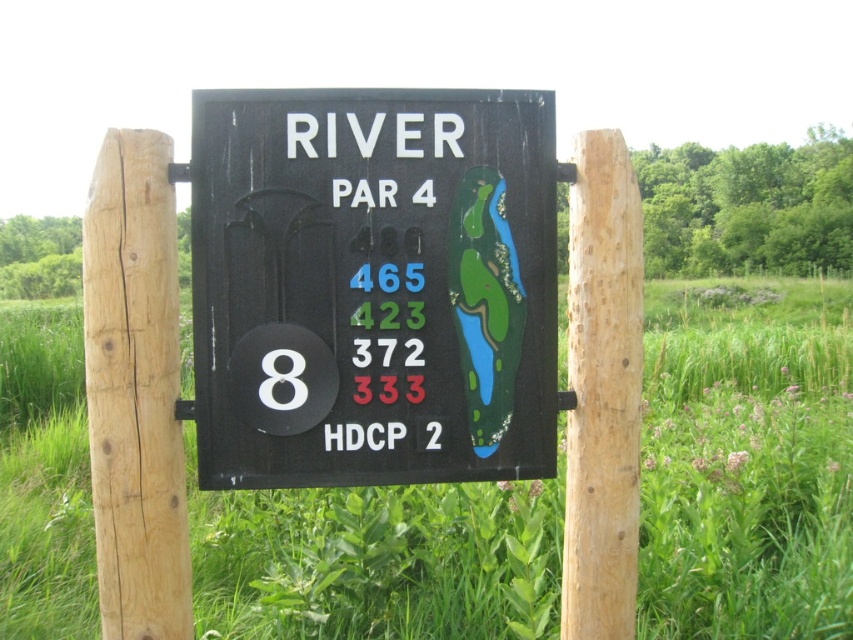
Who is higher up, light brown wood post at left or natural wood post at center?

light brown wood post at left

Consider the image. Which is more to the left, light brown wood post at left or natural wood post at center?

light brown wood post at left

What are the coordinates of `light brown wood post at left` in the screenshot? It's located at (135, 388).

From the picture: Is black matte sign at center above light brown wood post at left?

Yes, black matte sign at center is above light brown wood post at left.

Between black matte sign at center and light brown wood post at left, which one has less height?

Standing shorter between the two is black matte sign at center.

Image resolution: width=853 pixels, height=640 pixels. Identify the location of black matte sign at center. (373, 285).

Between point (543, 177) and point (575, 196), which one is positioned behind?

Point (575, 196)

Can you confirm if black matte sign at center is positioned to the left of natural wood post at center?

Indeed, black matte sign at center is positioned on the left side of natural wood post at center.

What are the coordinates of `black matte sign at center` in the screenshot? It's located at pyautogui.click(x=373, y=285).

Find the location of a particular element. The height and width of the screenshot is (640, 853). black matte sign at center is located at coordinates (373, 285).